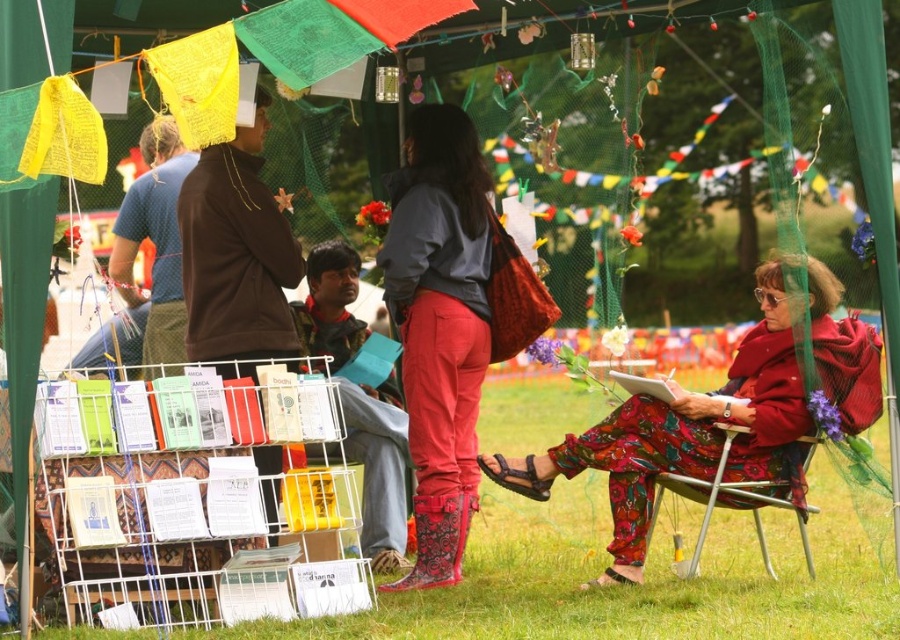
Between green grass at lower center and rubber boots at center, which one has more height?

Standing taller between the two is rubber boots at center.

Is green grass at lower center to the right of rubber boots at center from the viewer's perspective?

Yes, green grass at lower center is to the right of rubber boots at center.

Between point (884, 632) and point (420, 116), which one is positioned in front?

Point (884, 632)

I want to click on green grass at lower center, so click(633, 588).

Identify the location of rubber boots at center. The height and width of the screenshot is (640, 900). (441, 326).

Can you confirm if rubber boots at center is shorter than metallic silver chair at lower right?

Incorrect, rubber boots at center's height does not fall short of metallic silver chair at lower right's.

Between point (410, 444) and point (721, 468), which one is positioned behind?

The point (410, 444) is behind.

Identify the location of rubber boots at center. The image size is (900, 640). (441, 326).

Can you confirm if green grass at lower center is wider than metallic silver chair at lower right?

Yes.

Does green grass at lower center have a larger size compared to metallic silver chair at lower right?

Actually, green grass at lower center might be smaller than metallic silver chair at lower right.

Measure the distance between point (506, 528) and camera.

Point (506, 528) is 11.92 meters away from camera.

Locate an element on the screen. The height and width of the screenshot is (640, 900). green grass at lower center is located at coordinates (633, 588).